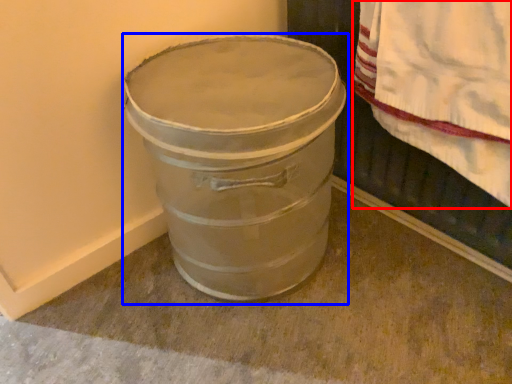
Question: Which object appears closest to the camera in this image, blanket (highlighted by a red box) or waste container (highlighted by a blue box)?

Choices:
 (A) blanket
 (B) waste container

Answer: (A)